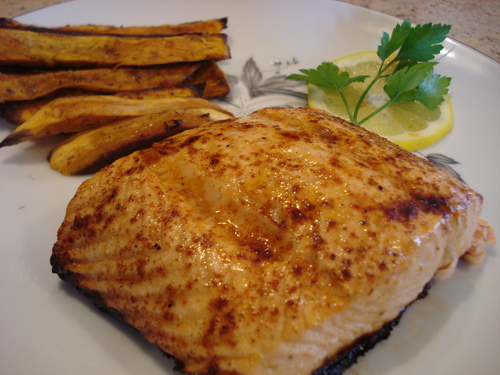
Find the location of a particular element. This screenshot has height=375, width=500. small specks on plate is located at coordinates tap(21, 207), tap(33, 179).